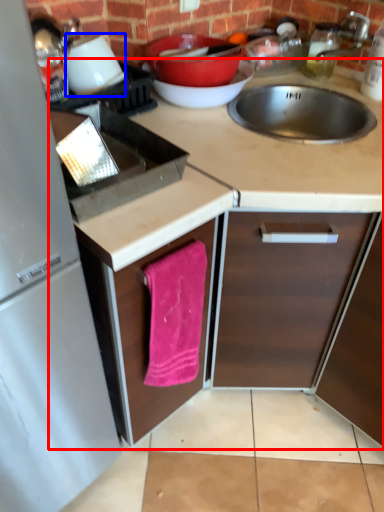
Question: Which object appears farthest to the camera in this image, countertop (highlighted by a red box) or appliance (highlighted by a blue box)?

Choices:
 (A) countertop
 (B) appliance

Answer: (B)